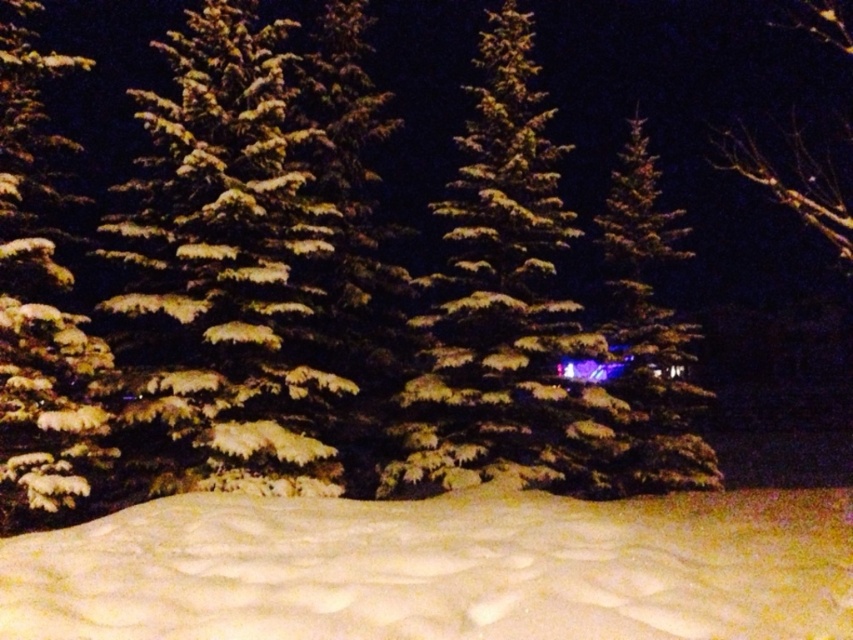
Does white fluffy snow at lower center appear under green matte evergreen at upper right?

Correct, white fluffy snow at lower center is located below green matte evergreen at upper right.

Based on the photo, is white fluffy snow at lower center smaller than green matte evergreen at upper right?

Indeed, white fluffy snow at lower center has a smaller size compared to green matte evergreen at upper right.

Which is behind, point (492, 637) or point (846, 248)?

Positioned behind is point (846, 248).

Identify the location of white fluffy snow at lower center. click(440, 570).

In the scene shown: Measure the distance from white fluffy snow at lower center to snow-covered pine tree at left.

white fluffy snow at lower center and snow-covered pine tree at left are 34.15 feet apart from each other.

This screenshot has height=640, width=853. What do you see at coordinates (440, 570) in the screenshot?
I see `white fluffy snow at lower center` at bounding box center [440, 570].

Measure the distance between white fluffy snow at lower center and camera.

They are 14.04 feet apart.

The width and height of the screenshot is (853, 640). What are the coordinates of `white fluffy snow at lower center` in the screenshot? It's located at (440, 570).

Is snow-covered fir tree at center further to camera compared to snow-covered pine tree at left?

Yes, it is.

Does snow-covered fir tree at center have a greater height compared to snow-covered pine tree at left?

Correct, snow-covered fir tree at center is much taller as snow-covered pine tree at left.

Find the location of `snow-covered fir tree at center`. snow-covered fir tree at center is located at coordinates (500, 301).

At what (x,y) coordinates should I click in order to perform the action: click on snow-covered fir tree at center. Please return your answer as a coordinate pair (x, y). Looking at the image, I should click on (500, 301).